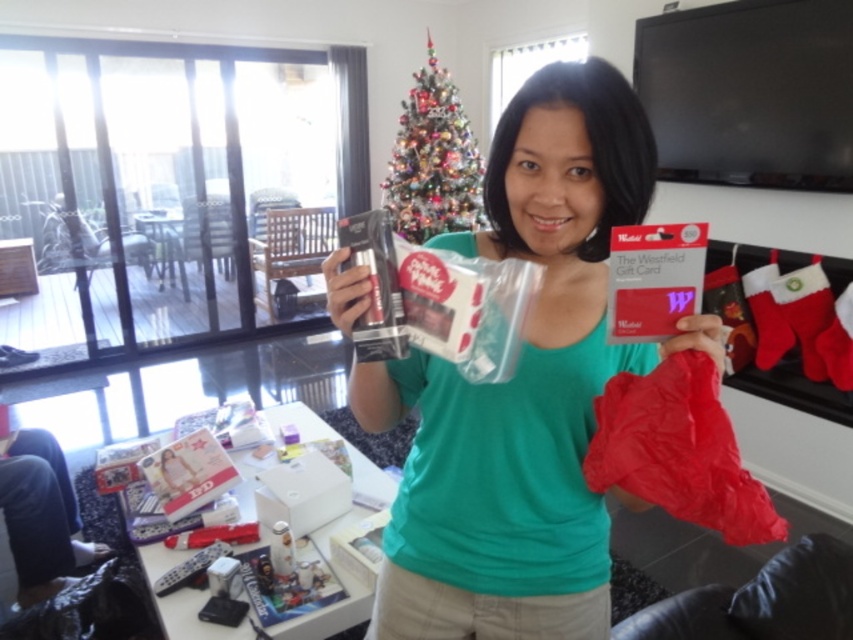
Is green matte shirt at center smaller than shiny silver christmas tree at upper center?

Yes, green matte shirt at center is smaller than shiny silver christmas tree at upper center.

Which of these two, green matte shirt at center or shiny silver christmas tree at upper center, stands taller?

shiny silver christmas tree at upper center is taller.

Does point (477, 400) lie in front of point (419, 225)?

That is True.

You are a GUI agent. You are given a task and a screenshot of the screen. Output one action in this format:
    pyautogui.click(x=<x>, y=<y>)
    Task: Click on the green matte shirt at center
    
    Given the screenshot: What is the action you would take?
    pyautogui.click(x=523, y=387)